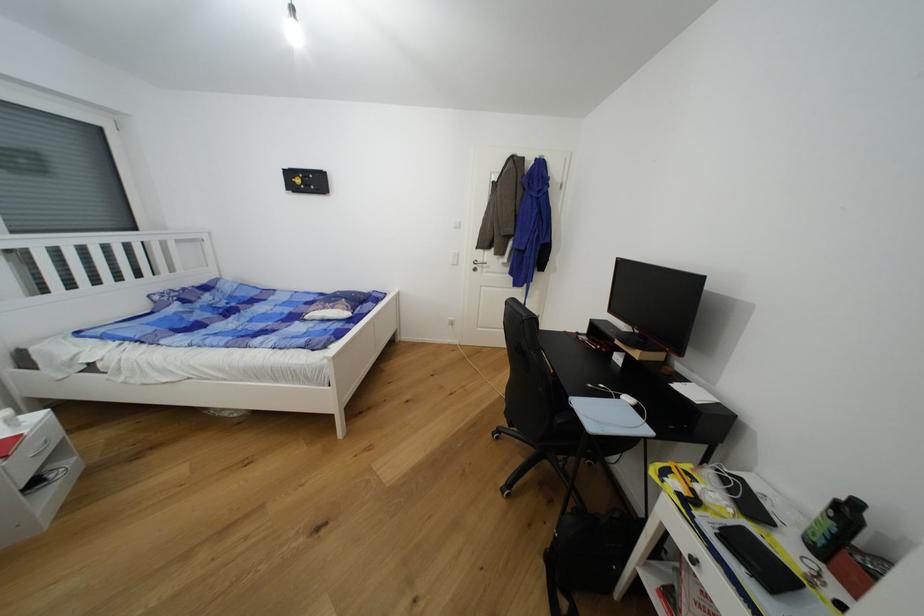
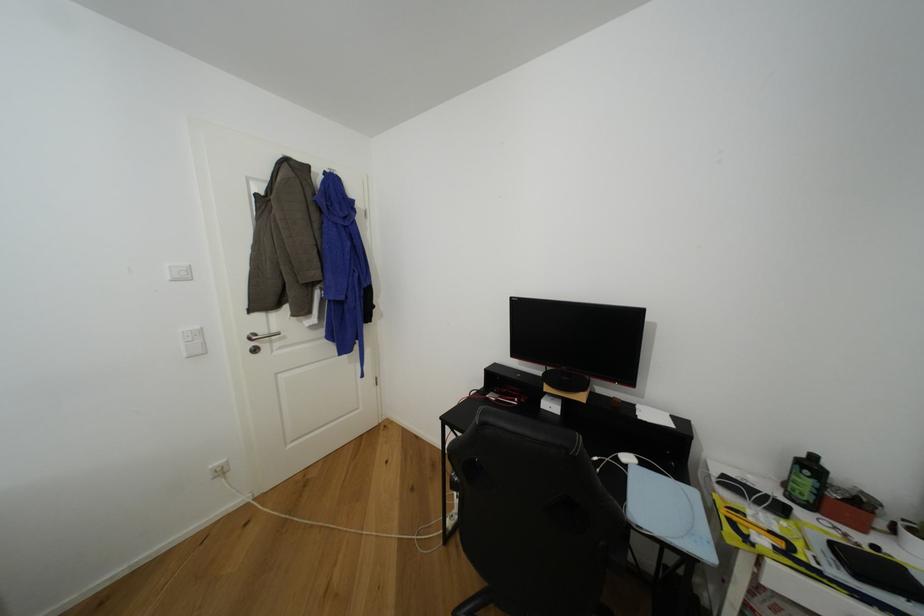
The point at (x=623, y=360) is marked in the first image. Where is the corresponding point in the second image?

(555, 408)